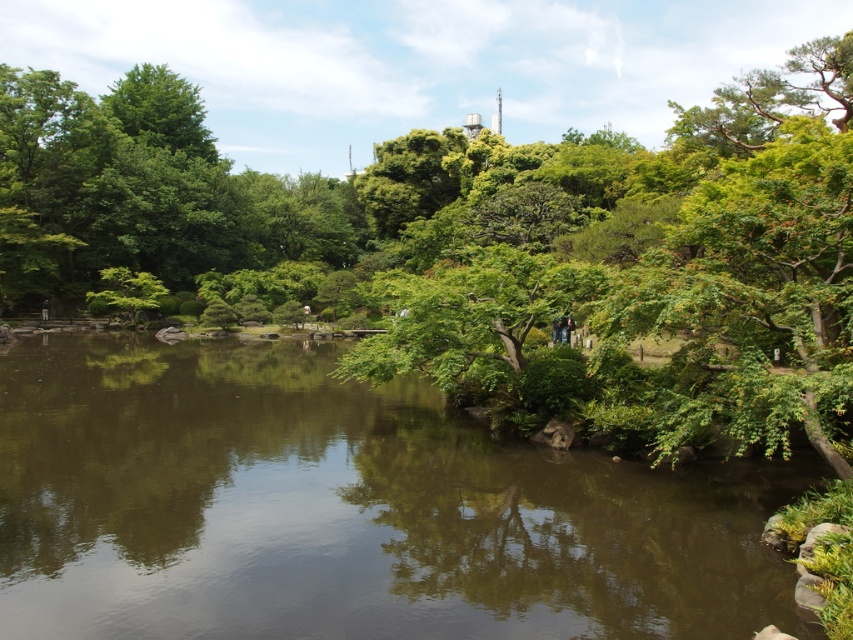
You are standing in the garden looking at the green leafy tree at center and the green reflective water at center. Which object is positioned to the left?

The green leafy tree at center is to the left of the green reflective water at center.

Consider the image. You are planning to take a photo of the green leafy tree at center and the green reflective water at center in the garden scene. Which object appears wider in the photo?

The green leafy tree at center appears wider in the photo because its width is larger than that of the green reflective water at center.

Looking at this image, you are a gardener planning to plant a new tree in the garden. You notice the green leafy tree at center and the green reflective water at center. Which object takes up more space in the image?

The green leafy tree at center has a larger size compared to the green reflective water at center, so it takes up more space in the image.